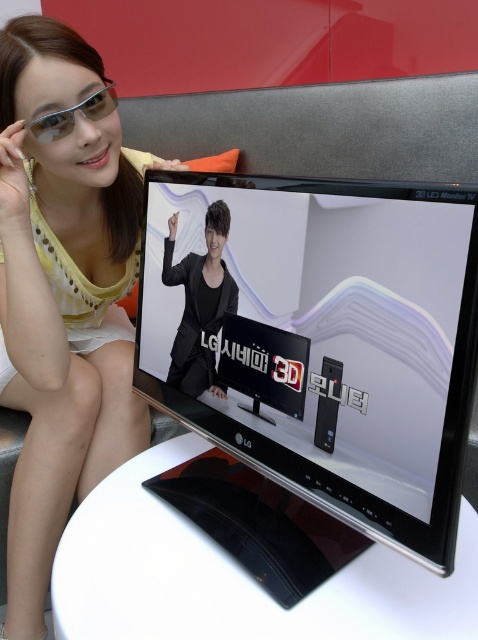
Who is higher up, black glossy monitor at center or black matte jacket at center?

black matte jacket at center is above.

Does black glossy monitor at center appear over black matte jacket at center?

No.

Identify the location of black glossy monitor at center. This screenshot has height=640, width=478. (321, 339).

You are a GUI agent. You are given a task and a screenshot of the screen. Output one action in this format:
    pyautogui.click(x=<x>, y=<y>)
    Task: Click on the black glossy monitor at center
    
    Given the screenshot: What is the action you would take?
    pyautogui.click(x=321, y=339)

Can you confirm if black glossy monitor at center is positioned to the right of white glossy table at center?

In fact, black glossy monitor at center is to the left of white glossy table at center.

Is the position of black glossy monitor at center more distant than that of white glossy table at center?

No, black glossy monitor at center is closer to the viewer.

Identify the location of black glossy monitor at center. (321, 339).

Is white glossy table at center below matte black glasses at upper left?

Indeed, white glossy table at center is positioned under matte black glasses at upper left.

Is white glossy table at center above matte black glasses at upper left?

No.

You are a GUI agent. You are given a task and a screenshot of the screen. Output one action in this format:
    pyautogui.click(x=<x>, y=<y>)
    Task: Click on the white glossy table at center
    
    Given the screenshot: What is the action you would take?
    pyautogui.click(x=234, y=577)

You are a GUI agent. You are given a task and a screenshot of the screen. Output one action in this format:
    pyautogui.click(x=<x>, y=<y>)
    Task: Click on the white glossy table at center
    
    Given the screenshot: What is the action you would take?
    pyautogui.click(x=234, y=577)